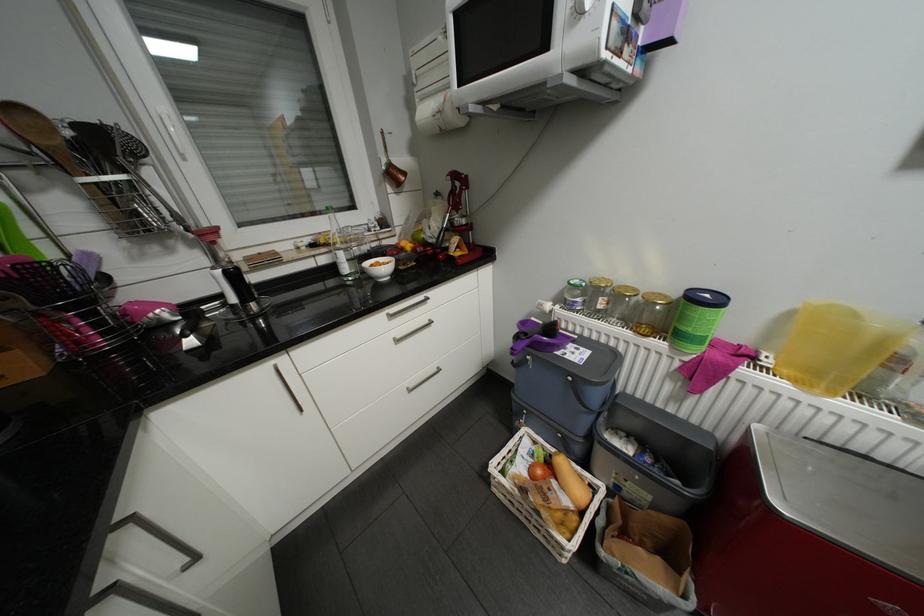
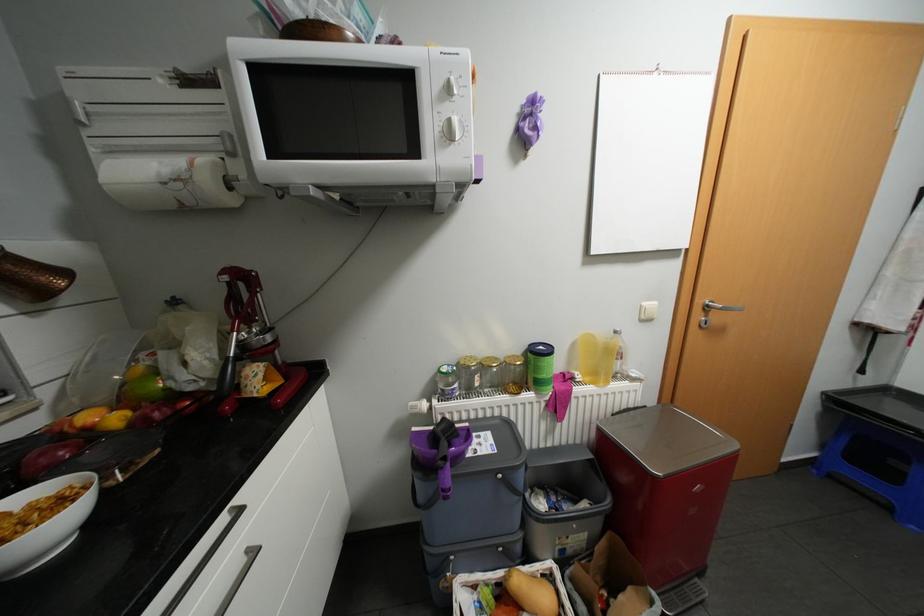
The point at (x=831, y=442) is marked in the first image. Where is the corresponding point in the second image?

(626, 411)